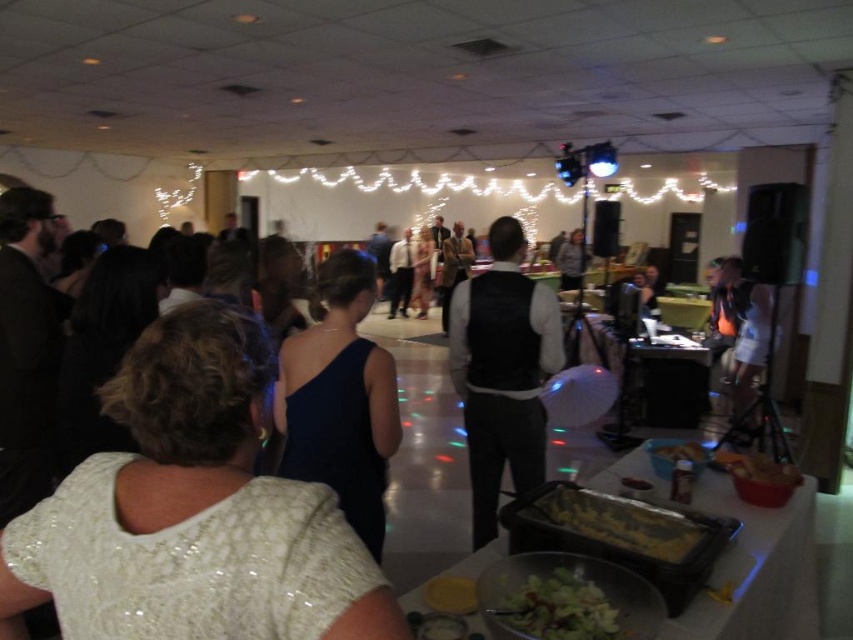
From the picture: Does green leafy salad at lower center appear on the left side of golden brown bread at center?

Indeed, green leafy salad at lower center is positioned on the left side of golden brown bread at center.

You are a GUI agent. You are given a task and a screenshot of the screen. Output one action in this format:
    pyautogui.click(x=<x>, y=<y>)
    Task: Click on the green leafy salad at lower center
    This screenshot has height=640, width=853.
    Given the screenshot: What is the action you would take?
    pyautogui.click(x=558, y=608)

Describe the element at coordinates (558, 608) in the screenshot. The height and width of the screenshot is (640, 853). I see `green leafy salad at lower center` at that location.

Identify the location of green leafy salad at lower center. (558, 608).

This screenshot has width=853, height=640. Describe the element at coordinates (340, 400) in the screenshot. I see `navy blue dress at center` at that location.

Between point (308, 372) and point (753, 364), which one is positioned behind?

Point (753, 364)

Where is `navy blue dress at center`? navy blue dress at center is located at coordinates (340, 400).

Can you confirm if yellow matte cake at lower center is wider than golden brown bread at center?

Indeed, yellow matte cake at lower center has a greater width compared to golden brown bread at center.

This screenshot has height=640, width=853. Find the location of `yellow matte cake at lower center`. yellow matte cake at lower center is located at coordinates (624, 524).

Where is `yellow matte cake at lower center`? This screenshot has width=853, height=640. yellow matte cake at lower center is located at coordinates (624, 524).